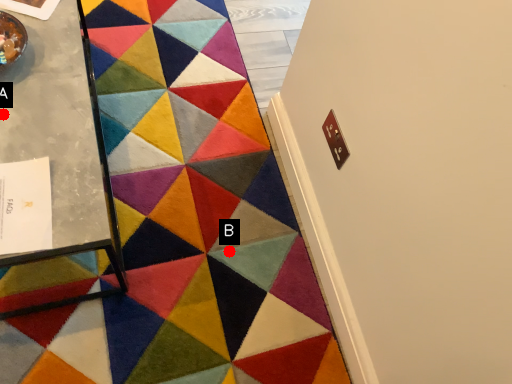
Question: Two points are circled on the image, labeled by A and B beside each circle. Which point is closer to the camera taking this photo?

Choices:
 (A) A is closer
 (B) B is closer

Answer: (A)